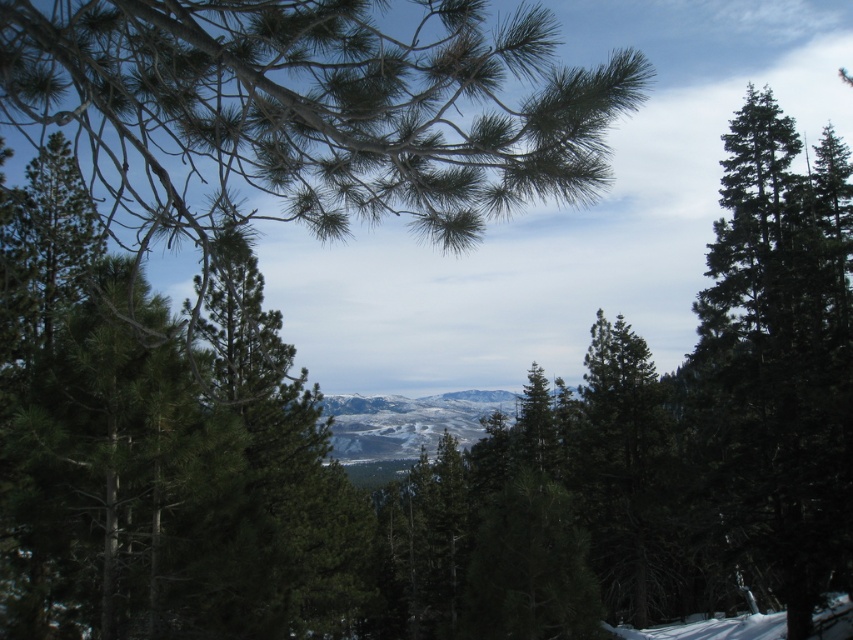
Question: Which point appears closest to the camera in this image?

Choices:
 (A) (724, 193)
 (B) (62, 104)

Answer: (A)

Question: Is green needle-like branches at upper left below green matte tree at right?

Choices:
 (A) yes
 (B) no

Answer: (B)

Question: Is green needle-like branches at upper left positioned behind green matte tree at right?

Choices:
 (A) yes
 (B) no

Answer: (B)

Question: Among these objects, which one is farthest from the camera?

Choices:
 (A) green matte tree at right
 (B) green needle-like branches at upper left

Answer: (A)

Question: Does green needle-like branches at upper left appear over green matte tree at right?

Choices:
 (A) yes
 (B) no

Answer: (A)

Question: Which object appears closest to the camera in this image?

Choices:
 (A) green needle-like branches at upper left
 (B) green matte tree at right

Answer: (A)